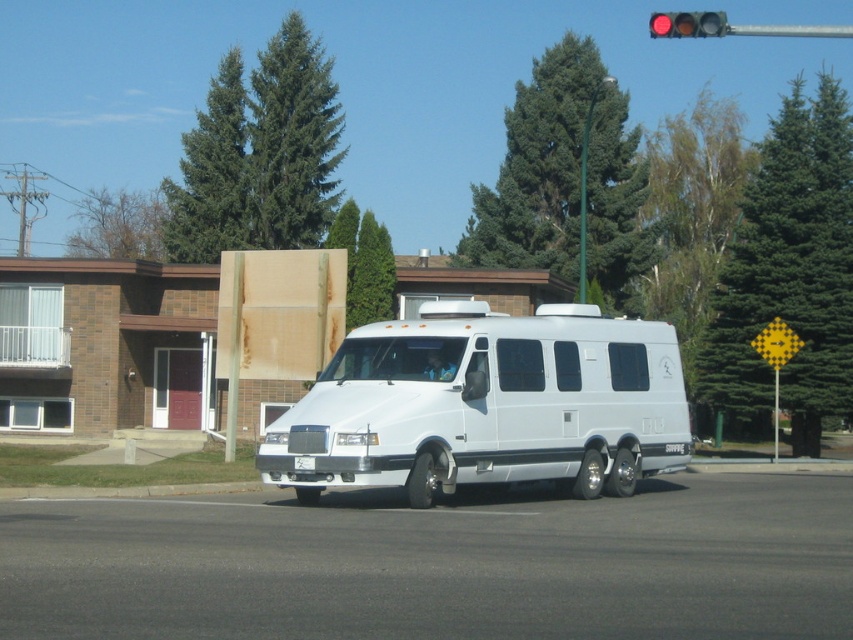
Question: Is white matte van at center further to camera compared to red glass traffic light at upper center?

Choices:
 (A) yes
 (B) no

Answer: (A)

Question: Which point appears farthest from the camera in this image?

Choices:
 (A) [x=567, y=413]
 (B) [x=656, y=17]

Answer: (B)

Question: Can you confirm if white matte van at center is positioned to the left of red glass traffic light at upper center?

Choices:
 (A) no
 (B) yes

Answer: (B)

Question: Among these points, which one is nearest to the camera?

Choices:
 (A) (712, 32)
 (B) (641, 388)

Answer: (B)

Question: Which object is farther from the camera taking this photo?

Choices:
 (A) red glass traffic light at upper center
 (B) white matte van at center

Answer: (B)

Question: From the image, what is the correct spatial relationship of white matte van at center in relation to red glass traffic light at upper center?

Choices:
 (A) left
 (B) right

Answer: (A)